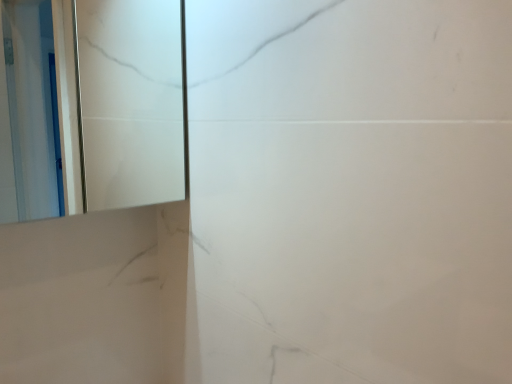
Image resolution: width=512 pixels, height=384 pixels. Describe the element at coordinates (92, 105) in the screenshot. I see `white glossy mirror at upper left` at that location.

The height and width of the screenshot is (384, 512). I want to click on white glossy mirror at upper left, so click(92, 105).

The image size is (512, 384). What are the coordinates of `white glossy mirror at upper left` in the screenshot? It's located at (92, 105).